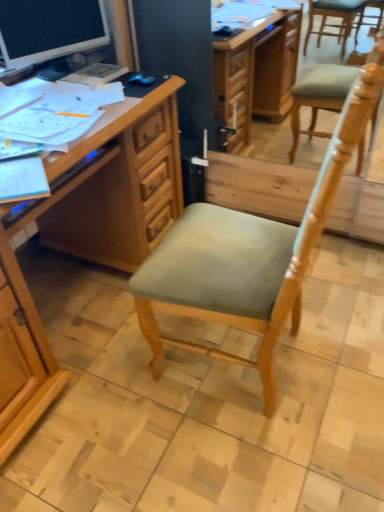
Question: Is the position of matte black monitor at upper left less distant than that of wooden desk at left?

Choices:
 (A) no
 (B) yes

Answer: (A)

Question: From a real-world perspective, does matte black monitor at upper left sit lower than wooden desk at left?

Choices:
 (A) no
 (B) yes

Answer: (A)

Question: Could wooden desk at left be considered to be inside matte black monitor at upper left?

Choices:
 (A) yes
 (B) no

Answer: (B)

Question: Is matte black monitor at upper left oriented away from wooden desk at left?

Choices:
 (A) yes
 (B) no

Answer: (B)

Question: From the image's perspective, is matte black monitor at upper left located above wooden desk at left?

Choices:
 (A) yes
 (B) no

Answer: (A)

Question: Is matte black monitor at upper left completely or partially outside of wooden desk at left?

Choices:
 (A) no
 (B) yes

Answer: (B)

Question: Can you confirm if wooden desk at left is wider than matte black monitor at upper left?

Choices:
 (A) yes
 (B) no

Answer: (A)

Question: Can you confirm if wooden desk at left is smaller than matte black monitor at upper left?

Choices:
 (A) no
 (B) yes

Answer: (A)

Question: Is wooden desk at left to the left of matte black monitor at upper left from the viewer's perspective?

Choices:
 (A) no
 (B) yes

Answer: (B)

Question: Is wooden desk at left shorter than matte black monitor at upper left?

Choices:
 (A) yes
 (B) no

Answer: (B)

Question: From a real-world perspective, is wooden desk at left positioned under matte black monitor at upper left based on gravity?

Choices:
 (A) yes
 (B) no

Answer: (A)

Question: From the image's perspective, is wooden desk at left beneath matte black monitor at upper left?

Choices:
 (A) yes
 (B) no

Answer: (A)

Question: Is light green fabric chair at center inside wooden desk at left?

Choices:
 (A) yes
 (B) no

Answer: (B)